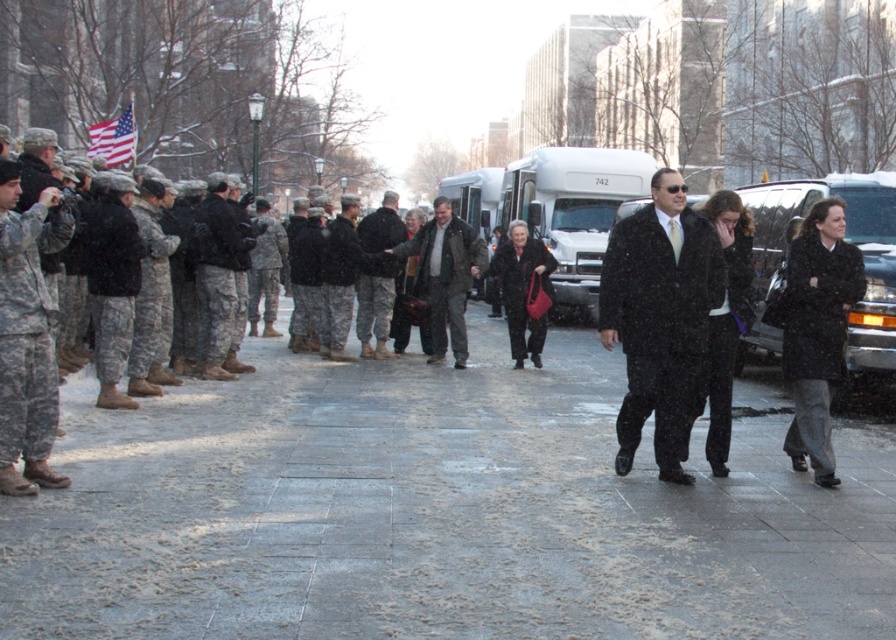
Question: Among these objects, which one is nearest to the camera?

Choices:
 (A) gray concrete sidewalk at center
 (B) camouflage uniform at left
 (C) dark gray wool coat at center

Answer: (A)

Question: Can you confirm if dark brown leather jacket at center is bigger than dark gray wool coat at center?

Choices:
 (A) yes
 (B) no

Answer: (B)

Question: Considering the real-world distances, which object is farthest from the black wool coat at center?

Choices:
 (A) american flag at upper left
 (B) dark brown leather jacket at center
 (C) camouflage uniform at left
 (D) camouflage uniform at center

Answer: (A)

Question: Considering the relative positions of gray concrete sidewalk at center and camouflage uniform at center in the image provided, where is gray concrete sidewalk at center located with respect to camouflage uniform at center?

Choices:
 (A) left
 (B) right

Answer: (B)

Question: Which of the following is the closest to the observer?

Choices:
 (A) black wool coat at center
 (B) dark brown leather jacket at center
 (C) dark gray wool coat at center
 (D) american flag at upper left

Answer: (A)

Question: Does dark brown leather jacket at center have a larger size compared to camouflage uniform at center?

Choices:
 (A) yes
 (B) no

Answer: (B)